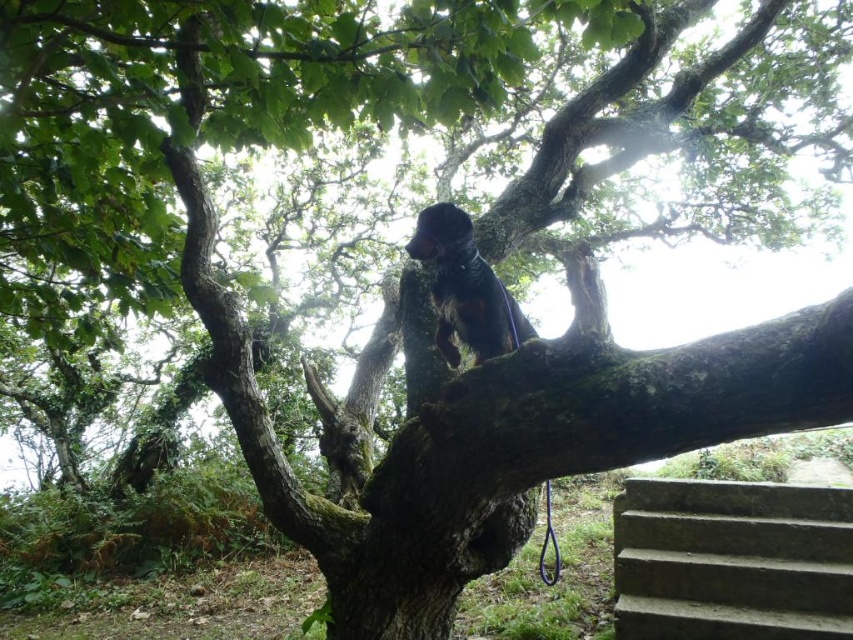
Which is below, gray concrete stairs at lower right or shiny brown fur at upper center?

gray concrete stairs at lower right is below.

Is gray concrete stairs at lower right below shiny brown fur at upper center?

Yes.

The image size is (853, 640). In order to click on gray concrete stairs at lower right in this screenshot , I will do `click(732, 561)`.